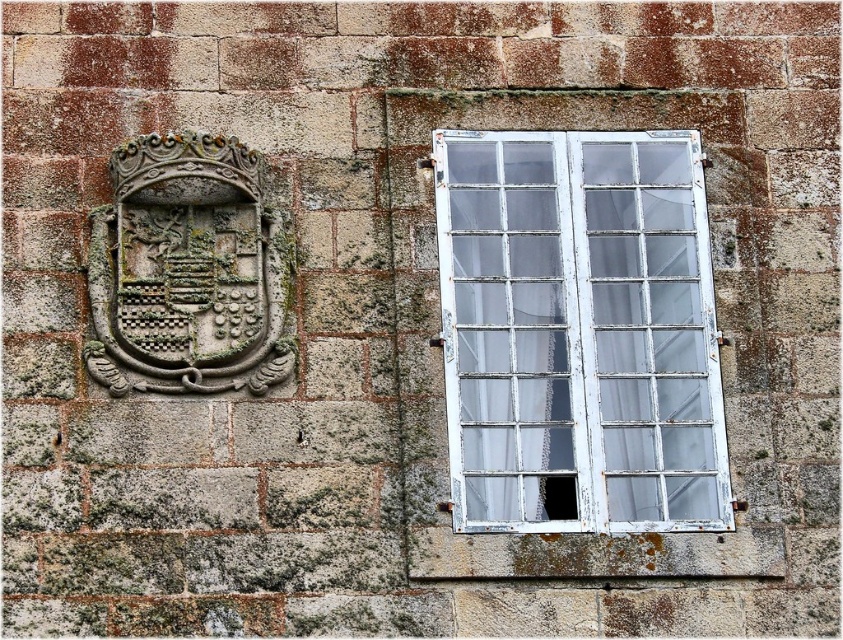
Question: Does white painted wood window at right appear over carved stone coat of arms at upper left?

Choices:
 (A) yes
 (B) no

Answer: (B)

Question: Is white painted wood window at right closer to camera compared to carved stone coat of arms at upper left?

Choices:
 (A) yes
 (B) no

Answer: (A)

Question: Which of the following is the closest to the observer?

Choices:
 (A) (518, 224)
 (B) (283, 272)

Answer: (B)

Question: Considering the relative positions of white painted wood window at right and carved stone coat of arms at upper left in the image provided, where is white painted wood window at right located with respect to carved stone coat of arms at upper left?

Choices:
 (A) above
 (B) below

Answer: (B)